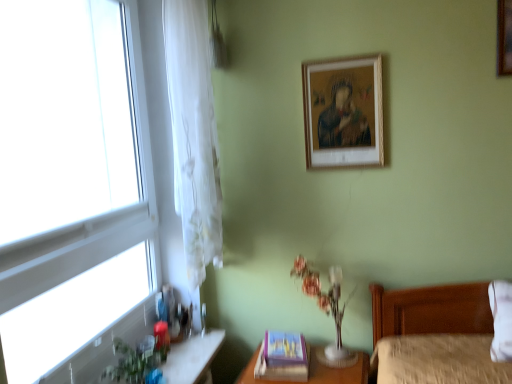
Question: From a real-world perspective, is translucent glass vase at center positioned above or below wooden table at lower right?

Choices:
 (A) below
 (B) above

Answer: (B)

Question: In terms of width, does translucent glass vase at center look wider or thinner when compared to wooden table at lower right?

Choices:
 (A) wide
 (B) thin

Answer: (B)

Question: Based on their relative distances, which object is farther from the wooden picture frame at upper center, marked as the 2th picture frame in a left-to-right arrangement?

Choices:
 (A) transparent glass window at left
 (B) wooden table at lower right
 (C) translucent glass vase at center
 (D) purple cardboard picture frame at lower center, the 1th picture frame in the left-to-right sequence
 (E) wooden picture frame at upper right, the third picture frame when ordered from left to right

Answer: (A)

Question: Estimate the real-world distances between objects in this image. Which object is farther from the wooden table at lower right?

Choices:
 (A) white sheer curtain at left
 (B) transparent glass window at left
 (C) purple cardboard picture frame at lower center, which is the third picture frame in right-to-left order
 (D) wooden picture frame at upper right, the third picture frame when ordered from left to right
 (E) translucent glass vanity at lower left

Answer: (D)